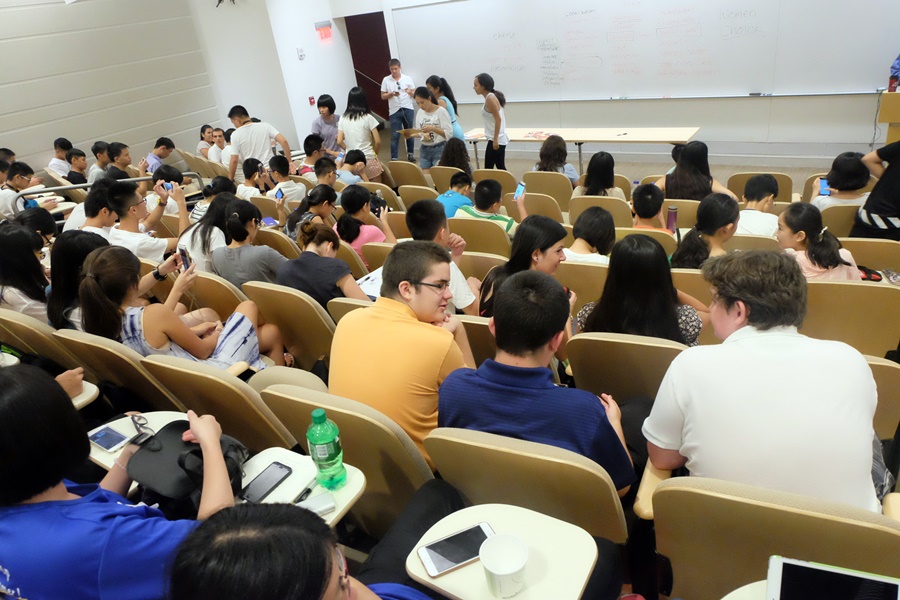
This screenshot has height=600, width=900. I want to click on blackboard, so click(x=508, y=42).